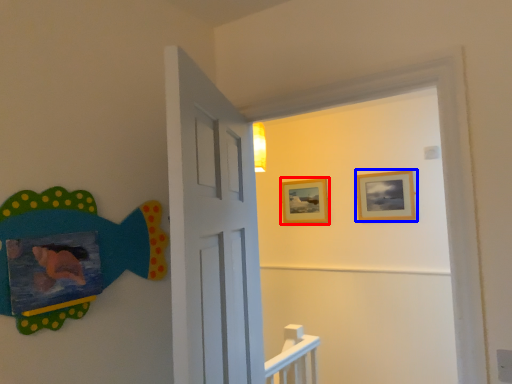
Question: Which object is closer to the camera taking this photo, picture frame (highlighted by a red box) or picture frame (highlighted by a blue box)?

Choices:
 (A) picture frame
 (B) picture frame

Answer: (B)